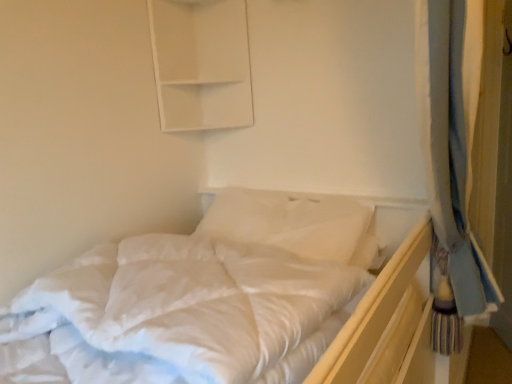
Question: Is point coord(352,231) positioned closer to the camera than point coord(184,248)?

Choices:
 (A) farther
 (B) closer

Answer: (A)

Question: Considering the relative positions of white soft pillow at center and white soft bed at center in the image provided, is white soft pillow at center to the left or to the right of white soft bed at center?

Choices:
 (A) left
 (B) right

Answer: (B)

Question: Based on their relative distances, which object is farther from the white soft bed at center?

Choices:
 (A) white soft pillow at center
 (B) white matte cabinet at upper center

Answer: (B)

Question: Considering the real-world distances, which object is closest to the white matte cabinet at upper center?

Choices:
 (A) white soft pillow at center
 (B) white soft bed at center

Answer: (A)